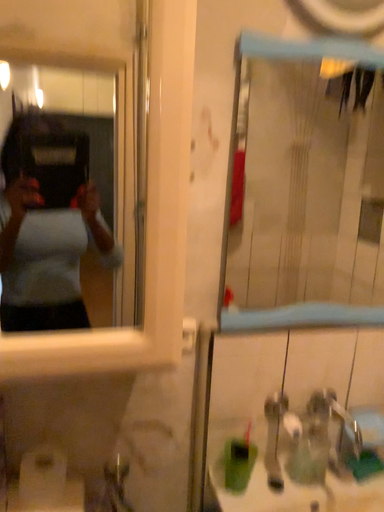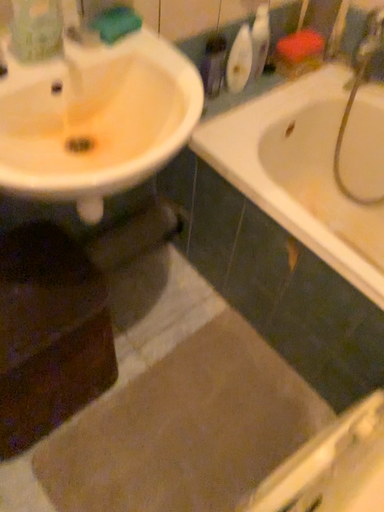
Question: Which way did the camera rotate in the video?

Choices:
 (A) rotated upward
 (B) rotated downward

Answer: (B)